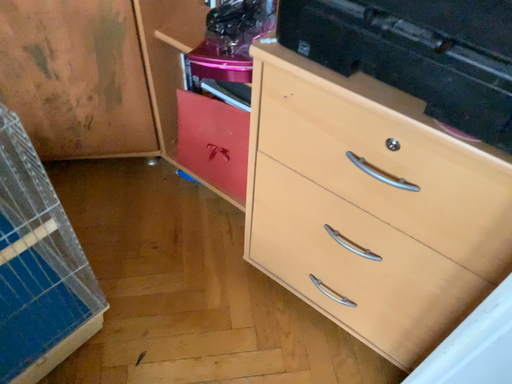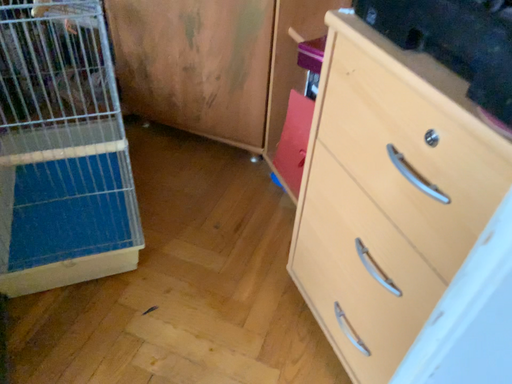
Question: Which way did the camera rotate in the video?

Choices:
 (A) rotated downward
 (B) rotated upward

Answer: (B)